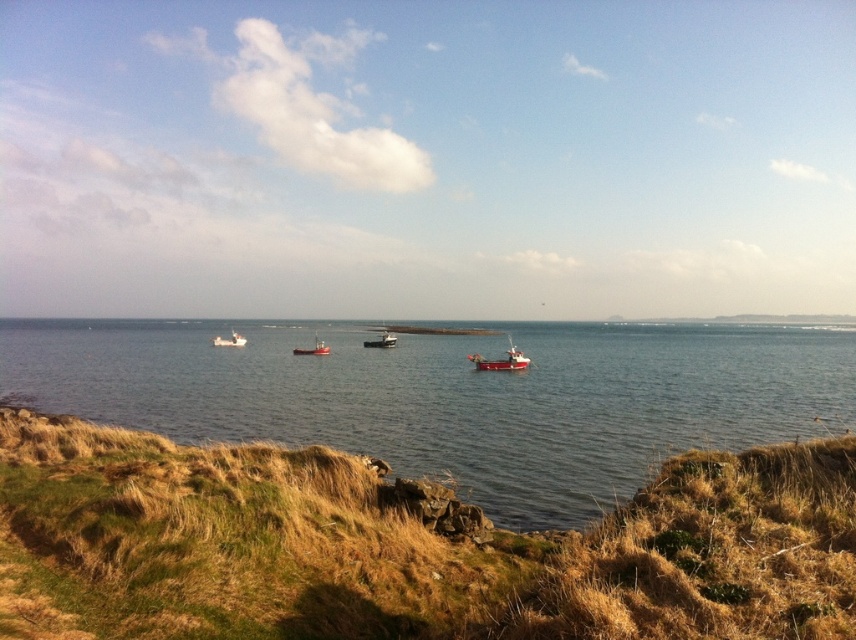
What do you see at coordinates (452, 396) in the screenshot? This screenshot has width=856, height=640. I see `clear water at center` at bounding box center [452, 396].

Can you confirm if clear water at center is taller than white matte boat at center?

Yes.

You are a GUI agent. You are given a task and a screenshot of the screen. Output one action in this format:
    pyautogui.click(x=<x>, y=<y>)
    Task: Click on the clear water at center
    The height and width of the screenshot is (640, 856).
    Given the screenshot: What is the action you would take?
    pyautogui.click(x=452, y=396)

Describe the element at coordinates (452, 396) in the screenshot. The height and width of the screenshot is (640, 856). I see `clear water at center` at that location.

Who is shorter, clear water at center or red matte boat at center?

With less height is red matte boat at center.

Is point (443, 444) positioned in front of point (317, 346)?

Yes.

The height and width of the screenshot is (640, 856). What are the coordinates of `clear water at center` in the screenshot? It's located at (452, 396).

Does red matte boat at center appear under white matte boat at center?

Yes.

At what (x,y) coordinates should I click in order to perform the action: click on red matte boat at center. Please return your answer as a coordinate pair (x, y). Looking at the image, I should click on (313, 348).